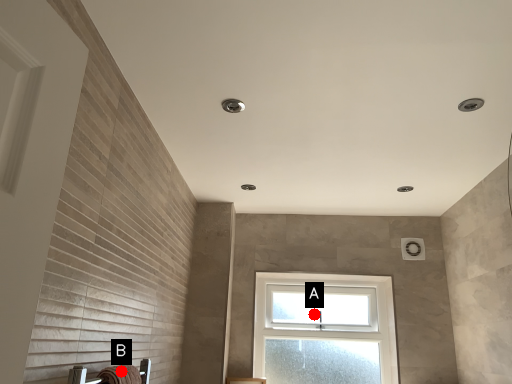
Question: Two points are circled on the image, labeled by A and B beside each circle. Which point is closer to the camera?

Choices:
 (A) A is closer
 (B) B is closer

Answer: (B)